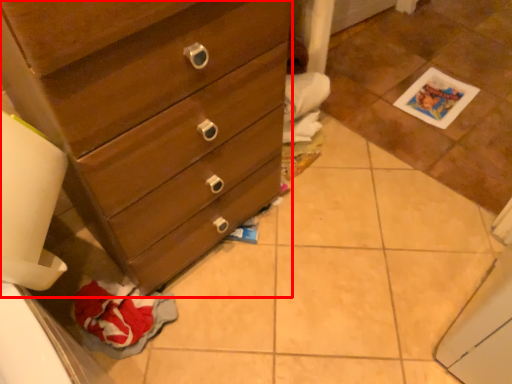
Question: Considering the relative positions of chest of drawers (annotated by the red box) and tile in the image provided, where is chest of drawers (annotated by the red box) located with respect to the staircase?

Choices:
 (A) right
 (B) left

Answer: (B)